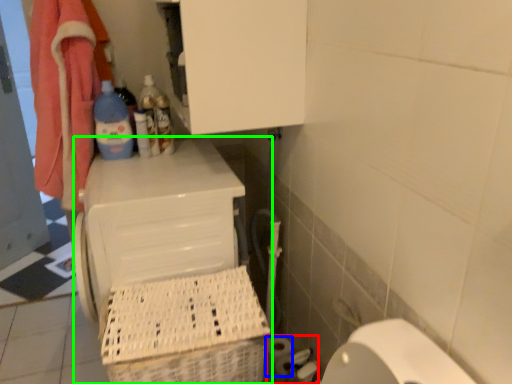
Question: Which is nearer to the toilet paper (highlighted by a red box)? toilet paper (highlighted by a blue box) or appliance (highlighted by a green box).

Choices:
 (A) toilet paper
 (B) appliance

Answer: (A)